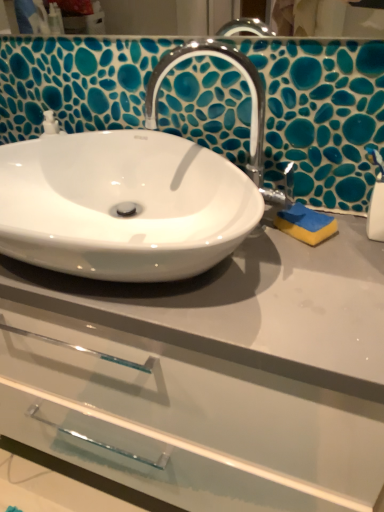
The width and height of the screenshot is (384, 512). What are the coordinates of `vacant area in front of white plastic soap dispenser at right` in the screenshot? It's located at (357, 296).